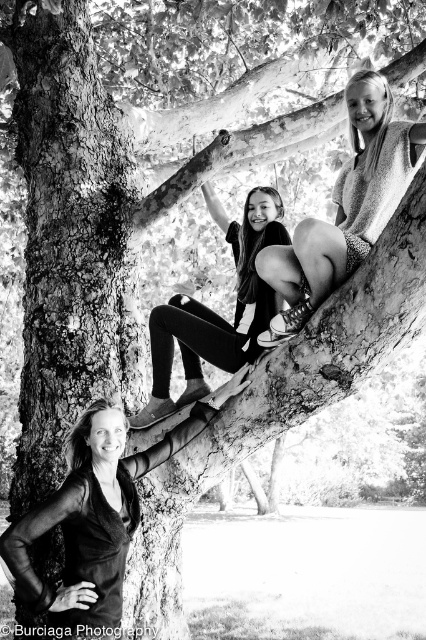
You are standing in front of the tree and see two points marked on the tree. Which point is closer to you, point (69, 506) or point (322, 298)?

Point (69, 506) is closer to you because it is further to the viewer than point (322, 298).

You are a fashion designer observing the black and white photograph. You need to determine which item of clothing is shorter between the smooth black dress at lower left and the matte black leggings at upper center. Which one is shorter?

The smooth black dress at lower left is shorter than the matte black leggings at upper center.